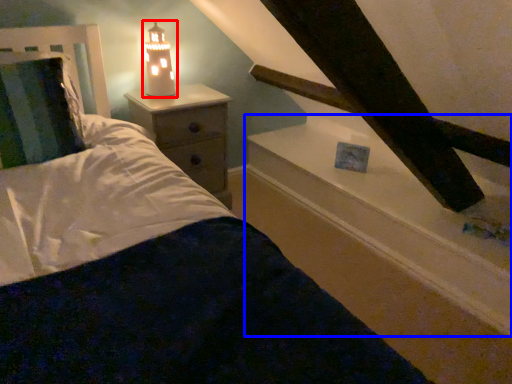
Question: Which object appears farthest to the camera in this image, lamp (highlighted by a red box) or window sill (highlighted by a blue box)?

Choices:
 (A) lamp
 (B) window sill

Answer: (A)